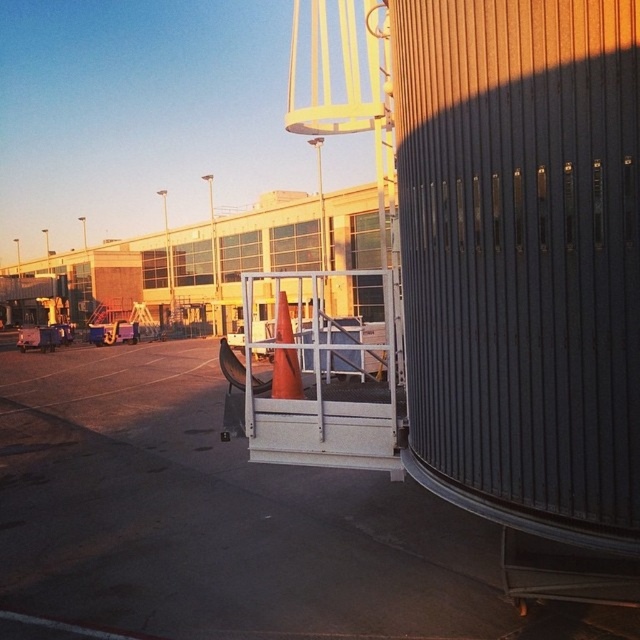
This screenshot has height=640, width=640. Describe the element at coordinates (227, 520) in the screenshot. I see `orange cone at center` at that location.

Locate an element on the screen. This screenshot has width=640, height=640. orange cone at center is located at coordinates (227, 520).